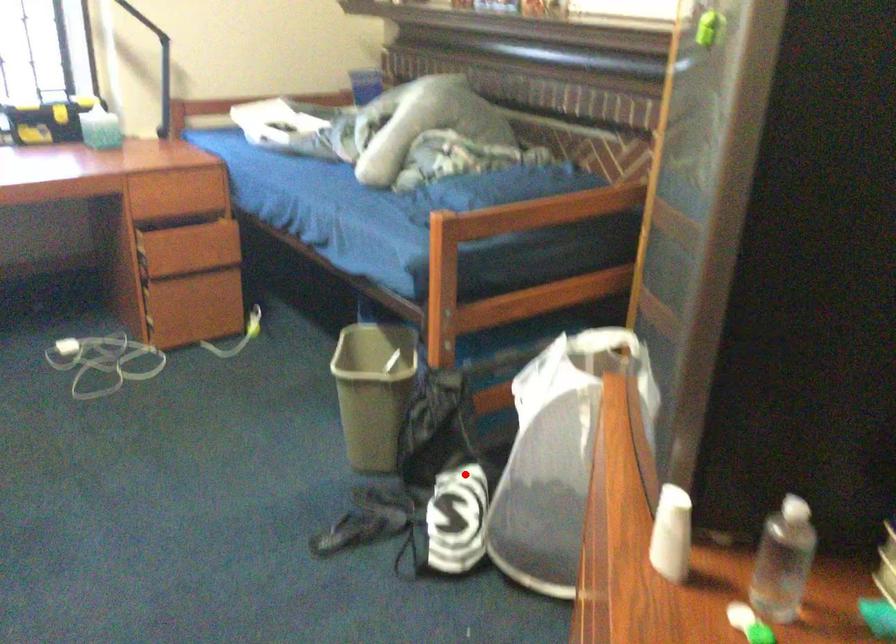
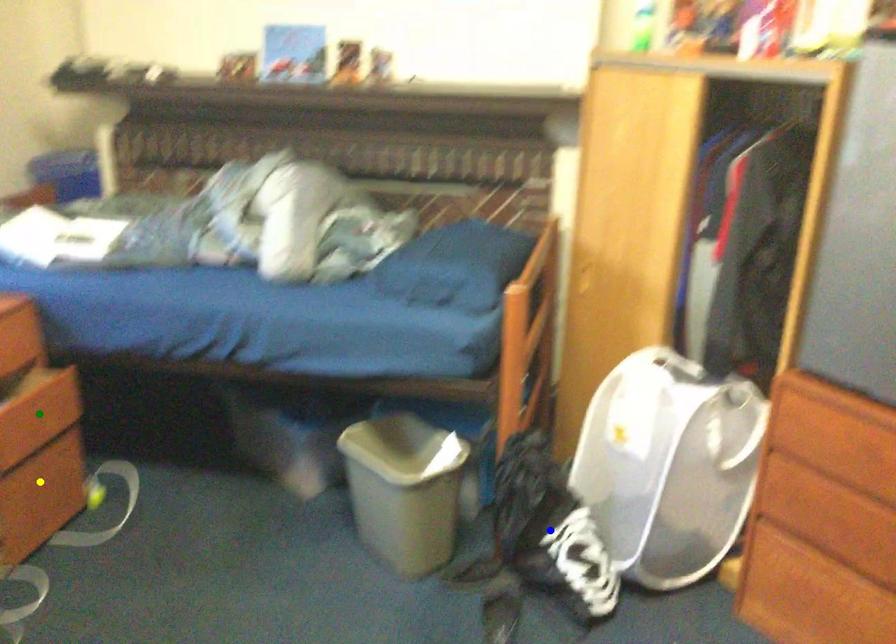
Question: I am providing you with two images of the same scene from different viewpoints. A red point is marked on the first image. You are given multiple points on the second image. In image 2, which mark is for the same physical point as the one in image 1?

Choices:
 (A) blue point
 (B) yellow point
 (C) green point

Answer: (A)